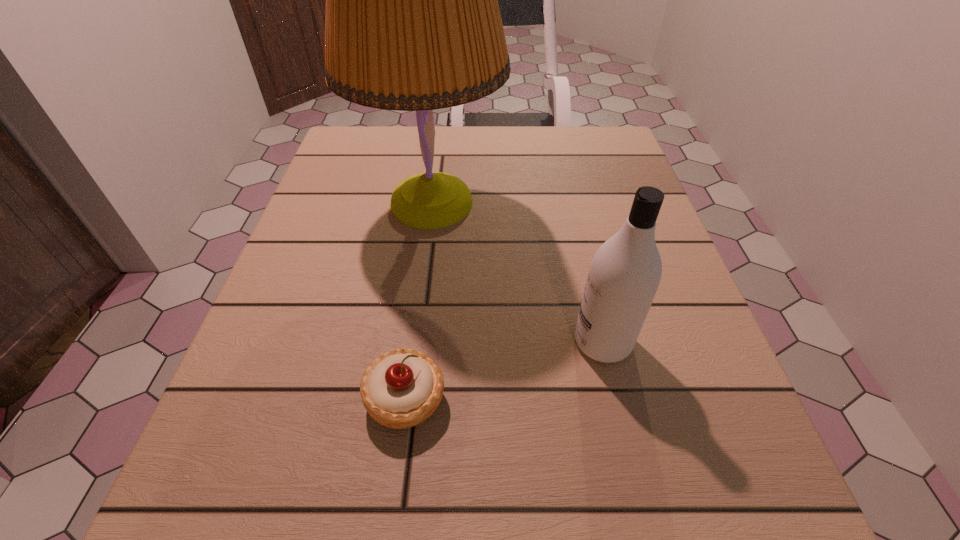
In the image, there is a desktop. What are the coordinates of `vacant space at the far right corner` in the screenshot? It's located at (604, 131).

Image resolution: width=960 pixels, height=540 pixels. Identify the location of free space between the pastry and the shampoo. (504, 370).

The height and width of the screenshot is (540, 960). What are the coordinates of `unoccupied position between the lamp and the second shortest object` in the screenshot? It's located at (517, 273).

You are a GUI agent. You are given a task and a screenshot of the screen. Output one action in this format:
    pyautogui.click(x=<x>, y=<y>)
    Task: Click on the vacant area that lies between the shampoo and the lamp
    Image resolution: width=960 pixels, height=540 pixels.
    Given the screenshot: What is the action you would take?
    pyautogui.click(x=517, y=273)

At what (x,y) coordinates should I click in order to perform the action: click on vacant area between the farthest object and the pastry. Please return your answer as a coordinate pair (x, y). Image resolution: width=960 pixels, height=540 pixels. Looking at the image, I should click on (419, 301).

The height and width of the screenshot is (540, 960). I want to click on free space between the lamp and the shortest object, so click(419, 301).

Locate an element on the screen. The height and width of the screenshot is (540, 960). empty space that is in between the tallest object and the second shortest object is located at coordinates (517, 273).

This screenshot has width=960, height=540. Find the location of `free space between the pastry and the lamp`. free space between the pastry and the lamp is located at coordinates (419, 301).

Locate an element on the screen. This screenshot has width=960, height=540. empty space between the shortest object and the shampoo is located at coordinates (504, 370).

You are a GUI agent. You are given a task and a screenshot of the screen. Output one action in this format:
    pyautogui.click(x=<x>, y=<y>)
    Task: Click on the vacant point located between the lamp and the shampoo
    
    Given the screenshot: What is the action you would take?
    pyautogui.click(x=517, y=273)